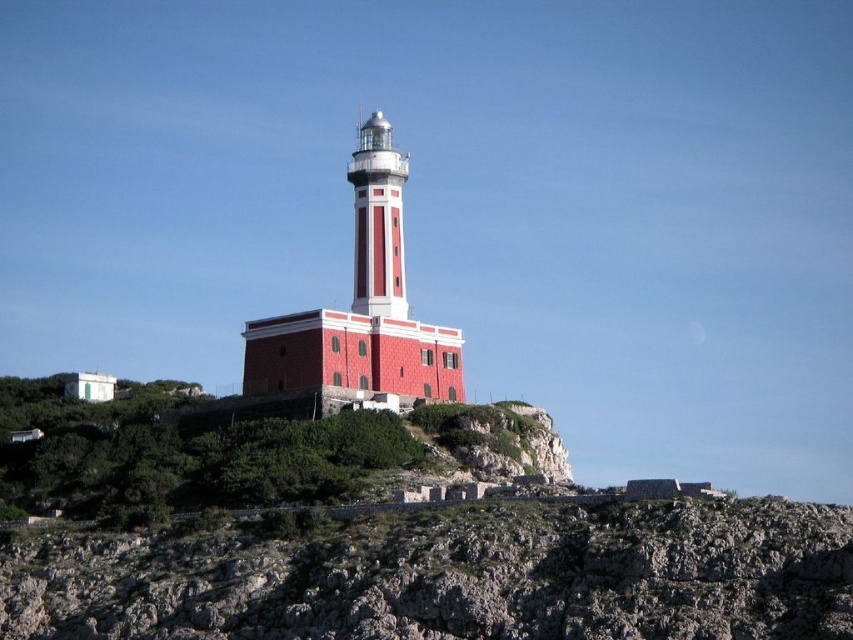
You are a hiker standing at the base of the green grassy hillside at lower left and want to reach the smooth red tower at center. Given that your average walking speed is 1.5 meters per second, how long will it take you to reach the tower? Please provide your answer in seconds, rounded to the nearest whole number.

The distance between the green grassy hillside at lower left and the smooth red tower at center is 23.50 meters. At a walking speed of 1.5 meters per second, dividing the distance by the speed gives approximately 15.67 seconds. Rounding to the nearest whole number, it will take about 16 seconds.

You are a hiker standing at the base of the smooth red tower at center. You want to reach the green grassy hillside at lower left. Which direction should you move relative to the tower?

The green grassy hillside at lower left is positioned under the smooth red tower at center, so you should move downward from the tower to reach it.